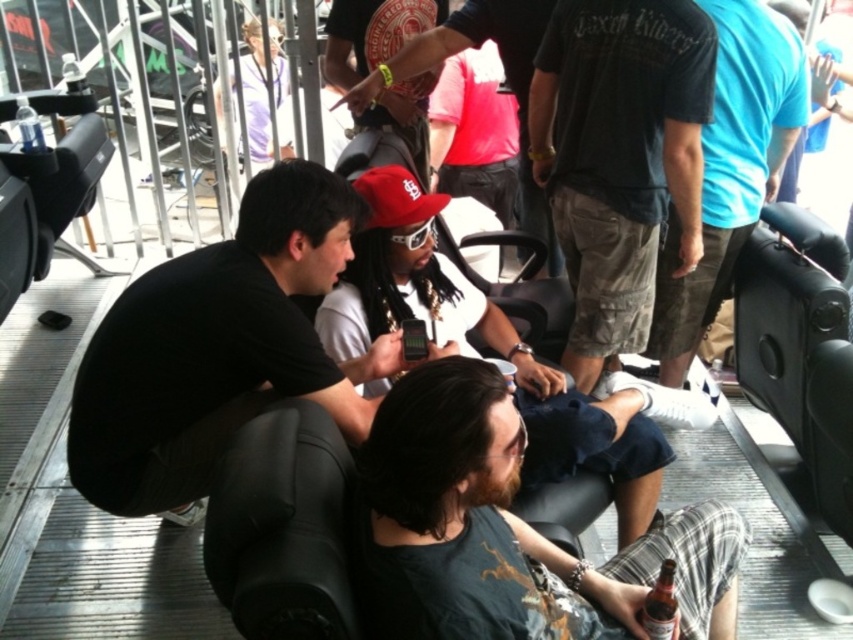
Is camo shorts at center behind matte white shirt at center?

Yes, it is.

Can you confirm if camo shorts at center is positioned to the right of matte white shirt at center?

Yes, camo shorts at center is to the right of matte white shirt at center.

Is point (584, 38) behind point (473, 316)?

No, it is not.

I want to click on camo shorts at center, so click(x=619, y=156).

Which is in front, point (585, 67) or point (525, 147)?

Point (585, 67)

Is camo shorts at center in front of matte black cap at center?

Yes, it is.

Between point (682, 218) and point (489, 13), which one is positioned in front?

Positioned in front is point (682, 218).

You are a GUI agent. You are given a task and a screenshot of the screen. Output one action in this format:
    pyautogui.click(x=<x>, y=<y>)
    Task: Click on the camo shorts at center
    
    Given the screenshot: What is the action you would take?
    pyautogui.click(x=619, y=156)

Which of these two, dark gray t-shirt at center or camouflage cargo shorts at center, stands shorter?

dark gray t-shirt at center

From the picture: Does dark gray t-shirt at center appear under camouflage cargo shorts at center?

Yes, dark gray t-shirt at center is below camouflage cargo shorts at center.

Is point (641, 600) closer to viewer compared to point (683, 348)?

That is True.

The height and width of the screenshot is (640, 853). In order to click on dark gray t-shirt at center in this screenshot , I will do `click(508, 531)`.